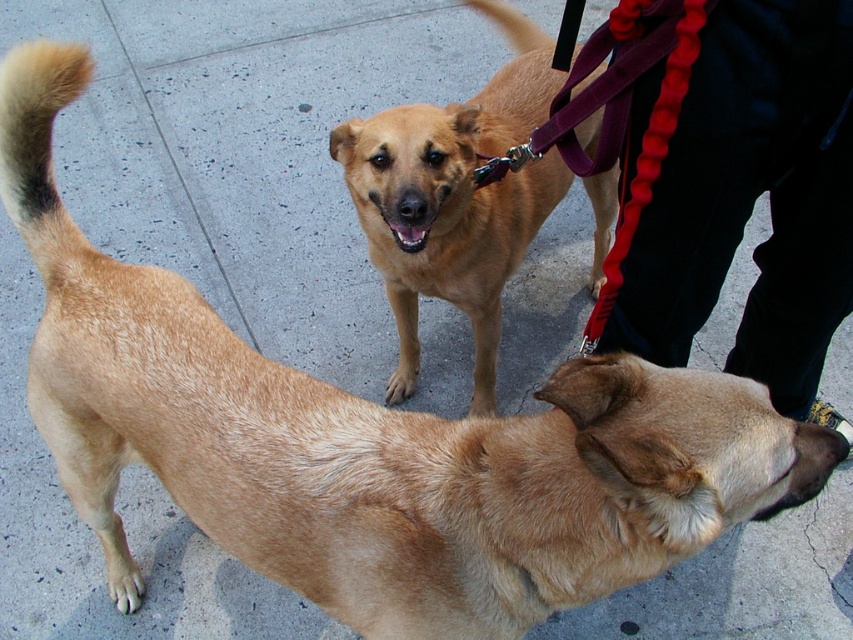
You are a dog walker holding the leash of the brown fur tail at upper left. You want to ensure both dogs can walk comfortably side by side on the sidewalk. Given that the golden fur dog at center is larger, which dog should you position closer to the curb to allow enough space?

Since the golden fur dog at center is larger, you should position the brown fur tail at upper left closer to the curb to allow enough space for the larger dog to walk comfortably.

You are a dog owner walking your dog on the sidewalk. You notice a golden fur dog at center and a brown fur tail at upper left. Which dog is closer to you?

The golden fur dog at center is closer to you because it is positioned under the brown fur tail at upper left, indicating it is in front.